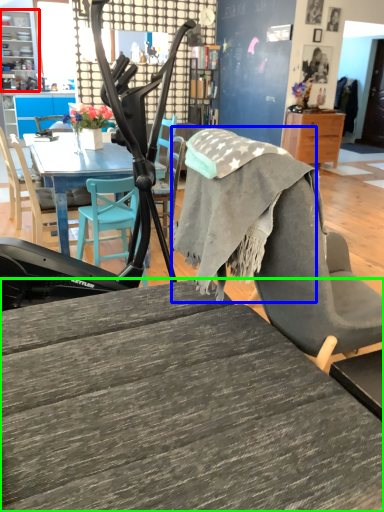
Question: Which is nearer to the cabinetry (highlighted by a red box)? fabric (highlighted by a blue box) or desk (highlighted by a green box).

Choices:
 (A) fabric
 (B) desk

Answer: (A)